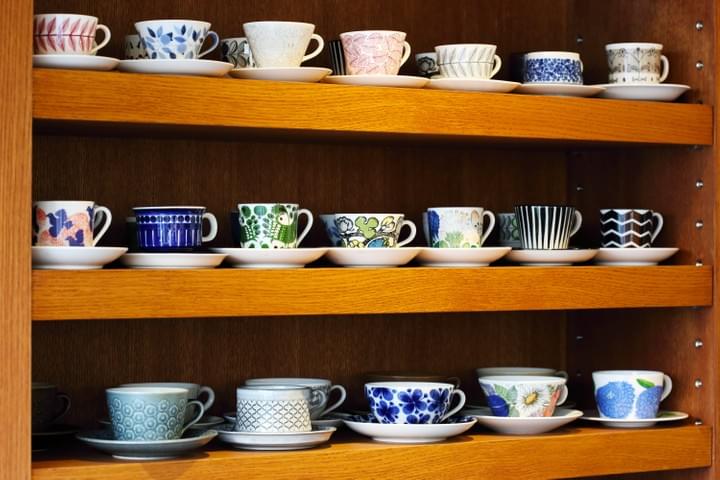
At what (x,y) coordinates should I click in order to perform the action: click on sets of cups and saucers on middle shelf. Please return your answer as a coordinate pair (x, y). Looking at the image, I should click on 639,234, 557,238, 504,229, 459,236, 423,220, 384,240, 327,235, 288,240, 181,240, 75,236.